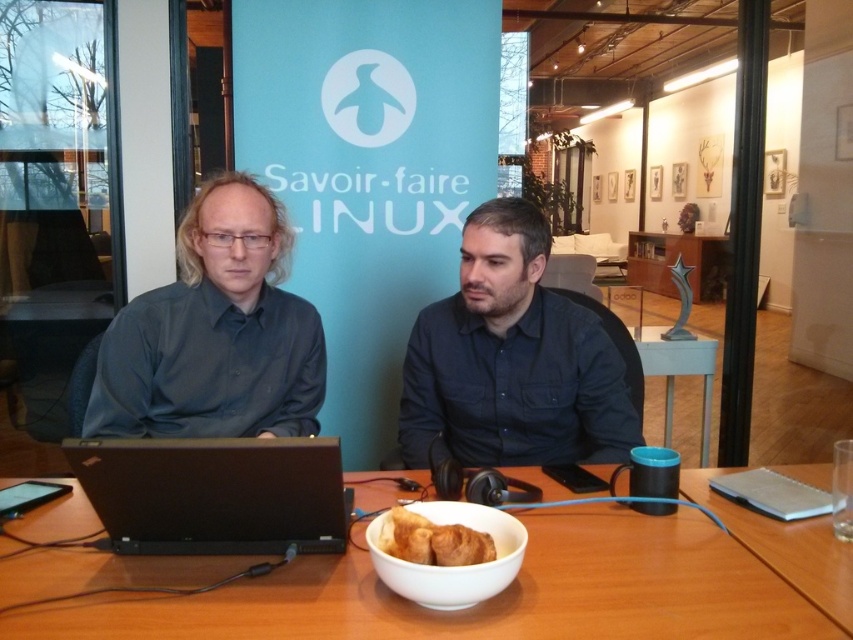
You are a delivery person who needs to place a small package on the wooden table at center without touching the dark blue shirt at center. Is there enough vertical space between the table and the shirt to do this?

The wooden table at center is shorter than the dark blue shirt at center, so there is enough vertical space to place the package on the wooden table at center without touching the dark blue shirt at center.

You are a delivery person who needs to place a package on the table. The package is 15 cm wide. The table has limited space between the white glossy bowl at lower center and the golden brown croissant at center. Can you fit the package there?

The white glossy bowl at lower center is to the right of the golden brown croissant at center. The distance between them isn